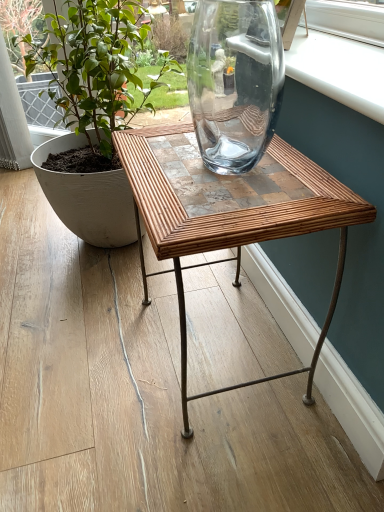
Question: From the image's perspective, would you say green matte plant at left is shown under bamboowoodentable at center?

Choices:
 (A) no
 (B) yes

Answer: (A)

Question: Is green matte plant at left looking in the opposite direction of bamboowoodentable at center?

Choices:
 (A) no
 (B) yes

Answer: (A)

Question: Is green matte plant at left at the left side of bamboowoodentable at center?

Choices:
 (A) yes
 (B) no

Answer: (A)

Question: Can bamboowoodentable at center be found inside green matte plant at left?

Choices:
 (A) yes
 (B) no

Answer: (B)

Question: Considering the relative sizes of green matte plant at left and bamboowoodentable at center in the image provided, is green matte plant at left taller than bamboowoodentable at center?

Choices:
 (A) no
 (B) yes

Answer: (B)

Question: Does green matte plant at left lie behind bamboowoodentable at center?

Choices:
 (A) yes
 (B) no

Answer: (A)

Question: Considering the relative positions of bamboowoodentable at center and green matte plant at left in the image provided, is bamboowoodentable at center to the right of green matte plant at left from the viewer's perspective?

Choices:
 (A) no
 (B) yes

Answer: (B)

Question: Is bamboowoodentable at center further to camera compared to green matte plant at left?

Choices:
 (A) no
 (B) yes

Answer: (A)

Question: From a real-world perspective, is bamboowoodentable at center over green matte plant at left?

Choices:
 (A) no
 (B) yes

Answer: (A)

Question: Is bamboowoodentable at center far from green matte plant at left?

Choices:
 (A) yes
 (B) no

Answer: (B)

Question: From a real-world perspective, is bamboowoodentable at center below green matte plant at left?

Choices:
 (A) no
 (B) yes

Answer: (B)

Question: Does bamboowoodentable at center have a larger size compared to green matte plant at left?

Choices:
 (A) yes
 (B) no

Answer: (B)

Question: Does point (107, 86) appear closer or farther from the camera than point (152, 242)?

Choices:
 (A) closer
 (B) farther

Answer: (B)